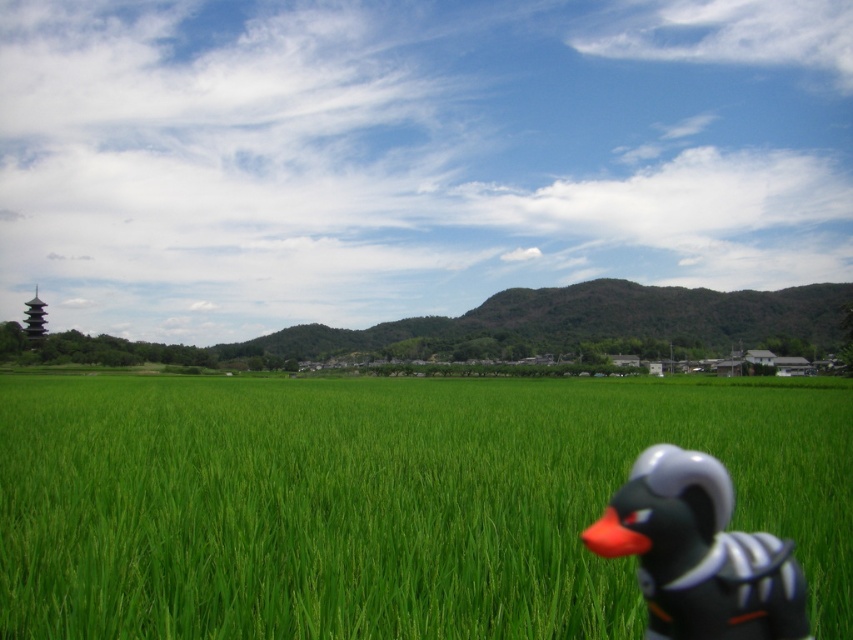
Which is behind, point (305, 518) or point (593, 529)?

Point (305, 518)

Between green grass at center and black matte rubber duck at lower right, which one appears on the right side from the viewer's perspective?

green grass at center is more to the right.

Measure the distance between point (512, 612) and camera.

Point (512, 612) is 8.97 feet away from camera.

Find the location of a particular element. This screenshot has height=640, width=853. green grass at center is located at coordinates (383, 500).